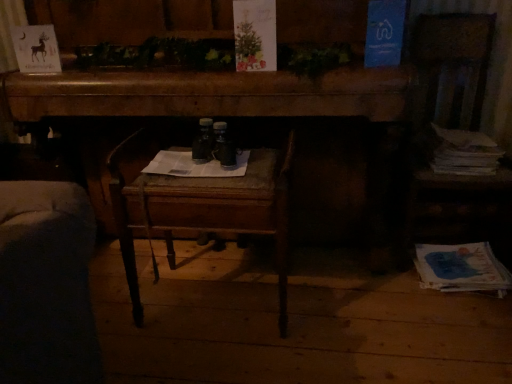
Question: Is white paper stack at right, positioned as the 2th magazine in bottom-to-top order, at the back of wooden chair at center?

Choices:
 (A) no
 (B) yes

Answer: (A)

Question: Is white paper stack at right, the first magazine viewed from the top, completely or partially inside wooden chair at center?

Choices:
 (A) no
 (B) yes

Answer: (A)

Question: Is wooden chair at center in contact with white paper stack at right, positioned as the 2th magazine in bottom-to-top order?

Choices:
 (A) no
 (B) yes

Answer: (A)

Question: Can you confirm if wooden chair at center is smaller than white paper stack at right, positioned as the 2th magazine in bottom-to-top order?

Choices:
 (A) no
 (B) yes

Answer: (A)

Question: Is wooden chair at center wider than white paper stack at right, the first magazine viewed from the top?

Choices:
 (A) yes
 (B) no

Answer: (A)

Question: Does point (251, 178) appear closer or farther from the camera than point (463, 130)?

Choices:
 (A) farther
 (B) closer

Answer: (B)

Question: Which is correct: wooden chair at center is inside white paper stack at right, the first magazine viewed from the top, or outside of it?

Choices:
 (A) outside
 (B) inside

Answer: (A)

Question: Relative to white paper stack at right, the first magazine viewed from the top, is wooden chair at center in front or behind?

Choices:
 (A) front
 (B) behind

Answer: (A)

Question: Considering the positions of wooden chair at center and white paper stack at right, the first magazine viewed from the top, in the image, is wooden chair at center wider or thinner than white paper stack at right, the first magazine viewed from the top,?

Choices:
 (A) wide
 (B) thin

Answer: (A)

Question: From a real-world perspective, is wooden desk at center above or below white paper stack at right, positioned as the 2th magazine in bottom-to-top order?

Choices:
 (A) above
 (B) below

Answer: (A)

Question: Is wooden desk at center inside the boundaries of white paper stack at right, positioned as the 2th magazine in bottom-to-top order, or outside?

Choices:
 (A) outside
 (B) inside

Answer: (A)

Question: Considering the positions of wooden desk at center and white paper stack at right, the first magazine viewed from the top, in the image, is wooden desk at center wider or thinner than white paper stack at right, the first magazine viewed from the top,?

Choices:
 (A) thin
 (B) wide

Answer: (B)

Question: In terms of height, does wooden desk at center look taller or shorter compared to white paper stack at right, the first magazine viewed from the top?

Choices:
 (A) tall
 (B) short

Answer: (A)

Question: Is wooden chair at center taller or shorter than blue paper at lower right, the 1th magazine positioned from the bottom?

Choices:
 (A) short
 (B) tall

Answer: (B)

Question: Is wooden chair at center situated inside blue paper at lower right, the 2th magazine from the top, or outside?

Choices:
 (A) inside
 (B) outside

Answer: (B)